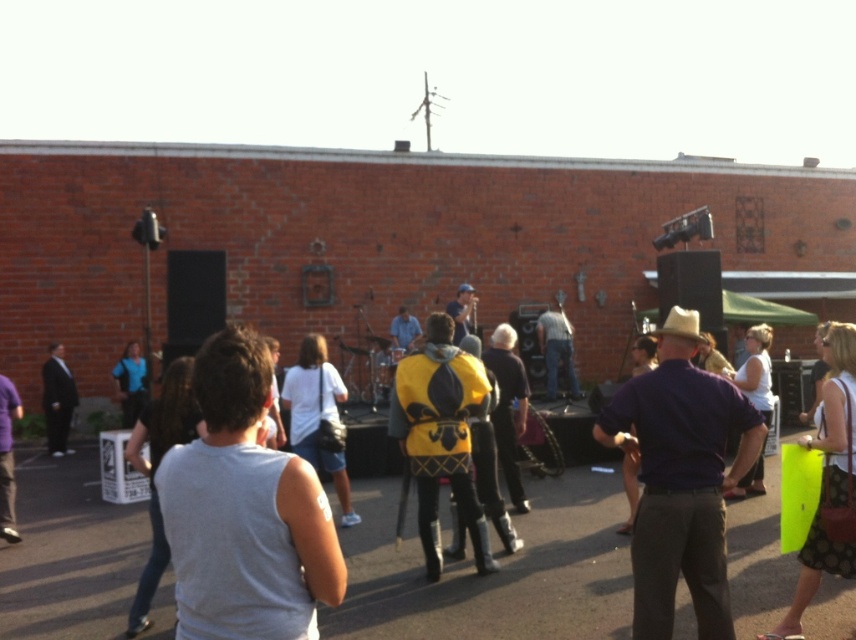
Question: Can you confirm if purple cotton shirt at center is positioned above matte black suit at left?

Choices:
 (A) no
 (B) yes

Answer: (B)

Question: Which is farther from the gray sleeveless shirt at lower left?

Choices:
 (A) white fabric shirt at center
 (B) gray cotton tank top at center
 (C) matte black suit at left

Answer: (B)

Question: Which object is farther from the camera taking this photo?

Choices:
 (A) gray sleeveless shirt at lower left
 (B) matte black suit at left

Answer: (B)

Question: Can you confirm if yellow fabric cape at center is positioned below white fabric shirt at center?

Choices:
 (A) yes
 (B) no

Answer: (B)

Question: Which of the following is the closest to the observer?

Choices:
 (A) matte black suit at left
 (B) yellow fabric cape at center

Answer: (B)

Question: Is purple cotton shirt at center above matte black suit at left?

Choices:
 (A) yes
 (B) no

Answer: (A)